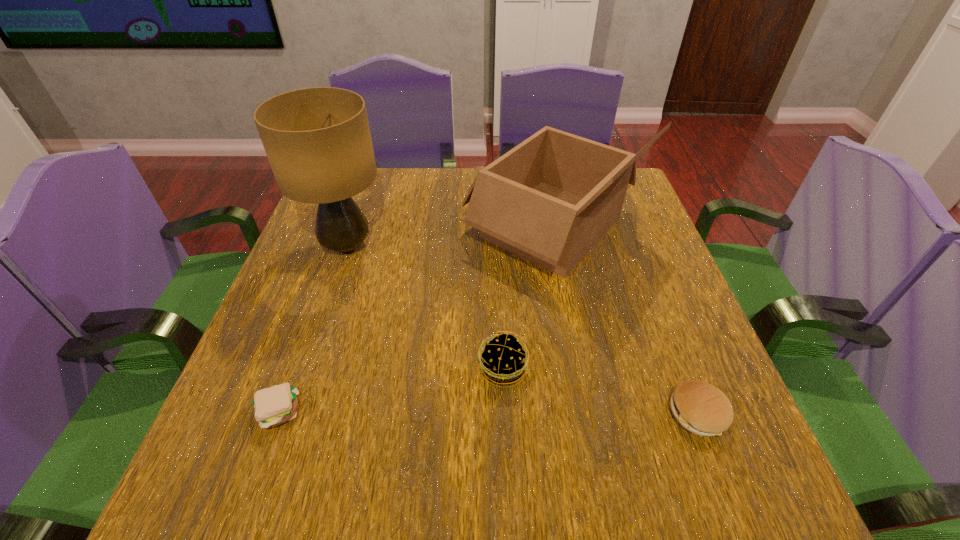
Find the location of a particular element. The height and width of the screenshot is (540, 960). blank area located 0.060m on the left of the rightmost patty is located at coordinates (635, 414).

Find the location of a particular element. The width and height of the screenshot is (960, 540). vacant space located 0.380m on the right of the shortest patty is located at coordinates (518, 413).

Locate an element on the screen. object that is at the far edge is located at coordinates (550, 199).

Find the location of a particular element. lampshade present at the left edge is located at coordinates (318, 142).

Where is `patty present at the left edge`? The width and height of the screenshot is (960, 540). patty present at the left edge is located at coordinates (273, 406).

The width and height of the screenshot is (960, 540). I want to click on box that is at the right edge, so click(x=550, y=199).

In order to click on patty located in the right edge section of the desktop in this screenshot , I will do pyautogui.click(x=699, y=407).

Where is `object at the far right corner`? This screenshot has width=960, height=540. object at the far right corner is located at coordinates (550, 199).

You are a GUI agent. You are given a task and a screenshot of the screen. Output one action in this format:
    pyautogui.click(x=<x>, y=<y>)
    Task: Click on the free region at the far edge
    This screenshot has width=960, height=540.
    Given the screenshot: What is the action you would take?
    pyautogui.click(x=459, y=184)

Where is `vacant space at the near edge of the desktop`? This screenshot has height=540, width=960. vacant space at the near edge of the desktop is located at coordinates (475, 501).